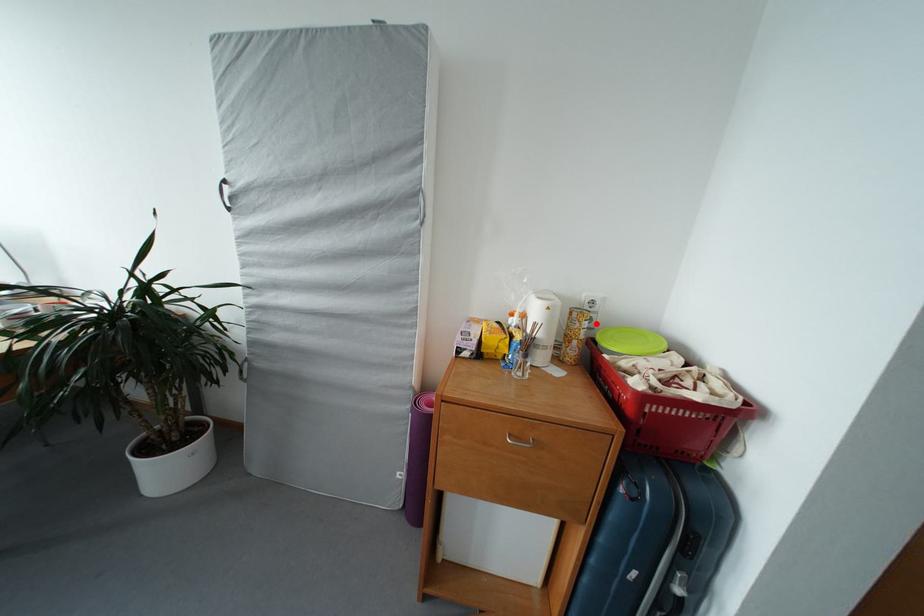
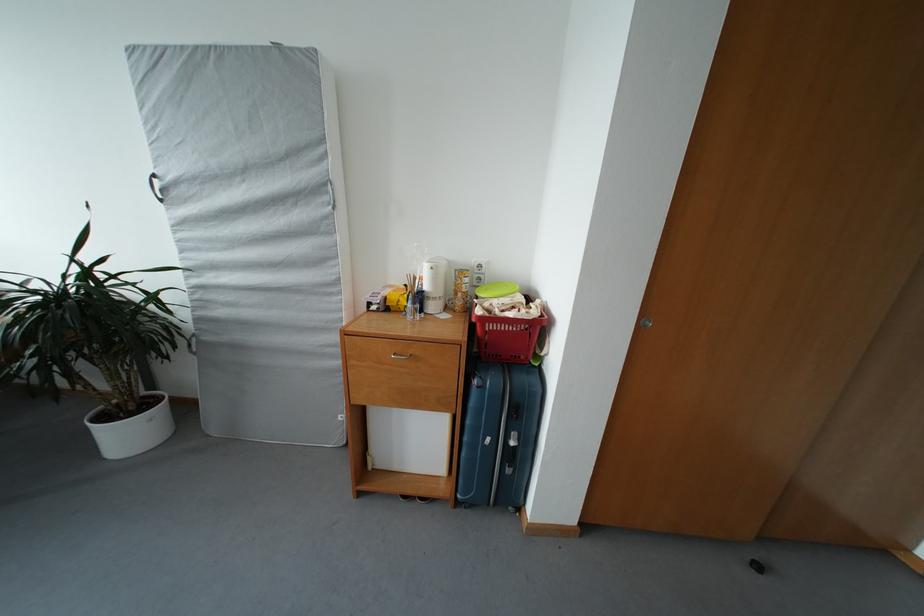
Locate, in the second image, the point that corresponds to the highlighted location in the first image.

(485, 284)